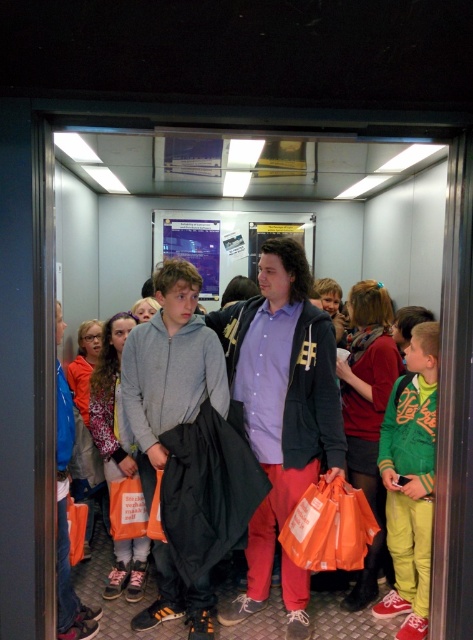
Is the position of green fleece jacket at right less distant than that of matte orange bag at center?

Yes, it is.

Does green fleece jacket at right appear on the left side of matte orange bag at center?

In fact, green fleece jacket at right is to the right of matte orange bag at center.

Who is more forward, (394, 512) or (347, 429)?

Point (394, 512) is in front.

What are the coordinates of `green fleece jacket at right` in the screenshot? It's located at (411, 481).

Which is above, matte orange bag at center or matte gray hoodie at center?

matte orange bag at center

Who is positioned more to the right, matte orange bag at center or matte gray hoodie at center?

Positioned to the right is matte orange bag at center.

Is point (376, 298) closer to viewer compared to point (115, 352)?

Yes, it is in front of point (115, 352).

Identify the location of matte orange bag at center. (367, 413).

Is matte gray hoodie at center thinner than orange fabric jacket at left?

Yes, matte gray hoodie at center is thinner than orange fabric jacket at left.

Image resolution: width=473 pixels, height=640 pixels. What do you see at coordinates (112, 403) in the screenshot?
I see `matte gray hoodie at center` at bounding box center [112, 403].

Who is more forward, (103, 380) or (105, 493)?

Point (103, 380) is in front.

The image size is (473, 640). I want to click on matte gray hoodie at center, so 112,403.